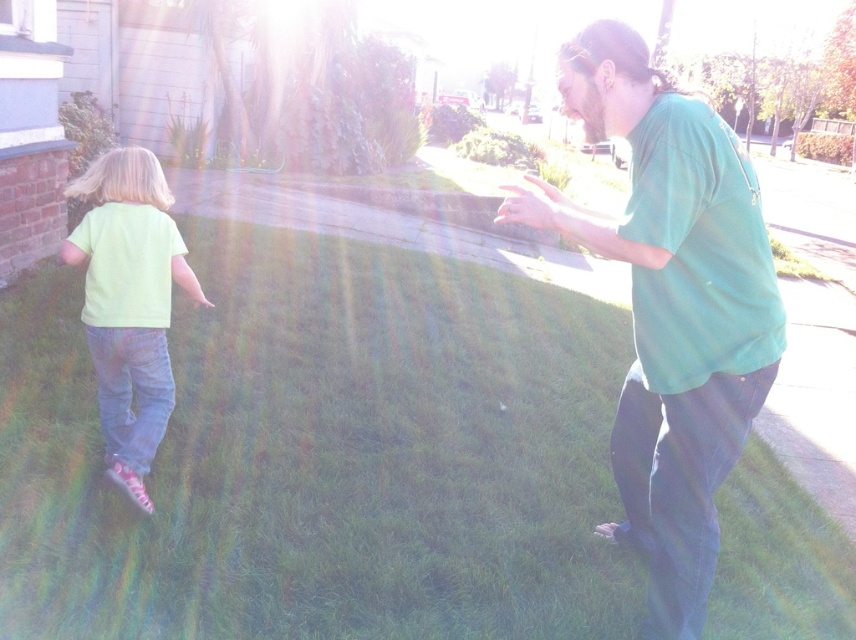
In the scene shown: How far apart are green grass at center and light green t-shirt at left?

A distance of 1.13 meters exists between green grass at center and light green t-shirt at left.

From the picture: Is green grass at center taller than light green t-shirt at left?

No.

I want to click on green grass at center, so click(324, 454).

The width and height of the screenshot is (856, 640). What are the coordinates of `green grass at center` in the screenshot? It's located at 324,454.

Is green grass at center bigger than green matte shirt at right?

Correct, green grass at center is larger in size than green matte shirt at right.

Is green grass at center smaller than green matte shirt at right?

Actually, green grass at center might be larger than green matte shirt at right.

Image resolution: width=856 pixels, height=640 pixels. I want to click on green grass at center, so [324, 454].

Find the location of `green grass at center`. green grass at center is located at coordinates (324, 454).

Does green matte shirt at right have a lesser height compared to light green t-shirt at left?

Incorrect, green matte shirt at right's height does not fall short of light green t-shirt at left's.

Between point (648, 330) and point (107, 152), which one is positioned behind?

The point (107, 152) is more distant.

Is point (629, 424) less distant than point (111, 188)?

Yes, it is.

You are a GUI agent. You are given a task and a screenshot of the screen. Output one action in this format:
    pyautogui.click(x=<x>, y=<y>)
    Task: Click on the green matte shirt at right
    
    Given the screenshot: What is the action you would take?
    pyautogui.click(x=670, y=307)